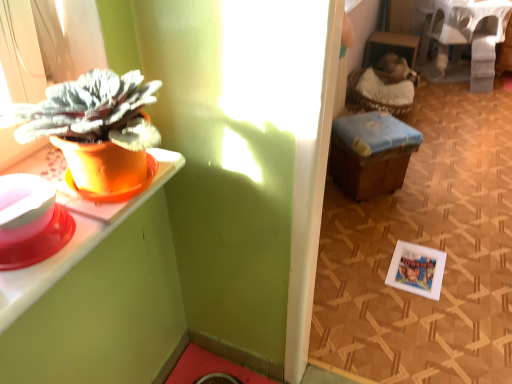
Question: Considering the relative positions of orange matte pot at left and wooden stool at center in the image provided, is orange matte pot at left in front of wooden stool at center?

Choices:
 (A) no
 (B) yes

Answer: (B)

Question: Is orange matte pot at left shorter than wooden stool at center?

Choices:
 (A) yes
 (B) no

Answer: (A)

Question: From the image's perspective, is orange matte pot at left on wooden stool at center?

Choices:
 (A) no
 (B) yes

Answer: (A)

Question: Does orange matte pot at left have a greater height compared to wooden stool at center?

Choices:
 (A) yes
 (B) no

Answer: (B)

Question: Does orange matte pot at left have a greater width compared to wooden stool at center?

Choices:
 (A) no
 (B) yes

Answer: (A)

Question: Does point (402, 129) appear closer or farther from the camera than point (415, 248)?

Choices:
 (A) farther
 (B) closer

Answer: (A)

Question: Considering the positions of wooden stool at center and white matte picture frame at lower right in the image, is wooden stool at center wider or thinner than white matte picture frame at lower right?

Choices:
 (A) thin
 (B) wide

Answer: (B)

Question: Considering the relative positions of wooden stool at center and white matte picture frame at lower right in the image provided, is wooden stool at center to the left or to the right of white matte picture frame at lower right?

Choices:
 (A) left
 (B) right

Answer: (A)

Question: In terms of height, does wooden stool at center look taller or shorter compared to white matte picture frame at lower right?

Choices:
 (A) short
 (B) tall

Answer: (B)

Question: Considering the relative positions of orange matte pot at left and wooden stool at center in the image provided, is orange matte pot at left to the left or to the right of wooden stool at center?

Choices:
 (A) right
 (B) left

Answer: (B)

Question: Is orange matte pot at left spatially inside wooden stool at center, or outside of it?

Choices:
 (A) inside
 (B) outside

Answer: (B)

Question: From the image's perspective, is orange matte pot at left located above or below wooden stool at center?

Choices:
 (A) below
 (B) above

Answer: (A)

Question: From a real-world perspective, is orange matte pot at left above or below wooden stool at center?

Choices:
 (A) above
 (B) below

Answer: (A)

Question: Is white fabric-covered table at upper right inside the boundaries of wooden stool at center, or outside?

Choices:
 (A) outside
 (B) inside

Answer: (A)

Question: From the image's perspective, is white fabric-covered table at upper right positioned above or below wooden stool at center?

Choices:
 (A) above
 (B) below

Answer: (A)